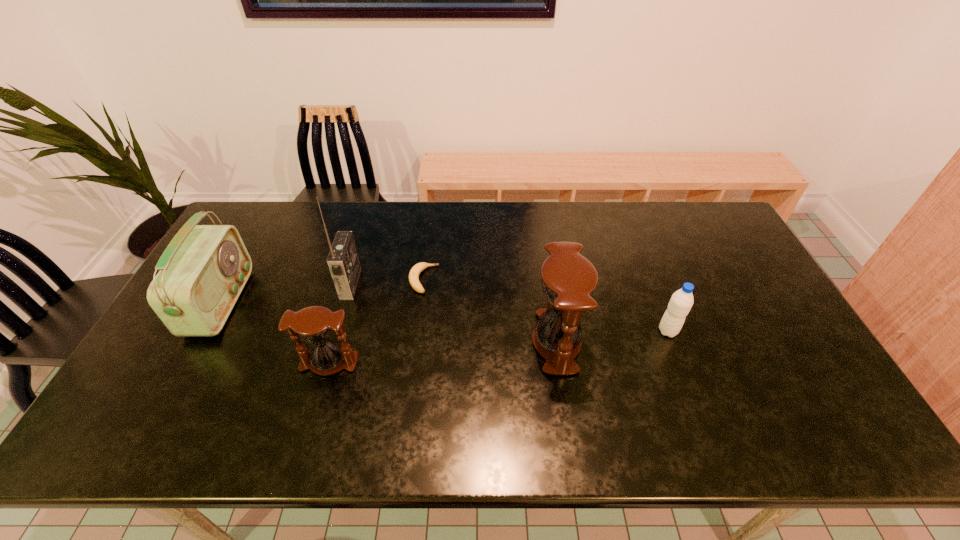
The width and height of the screenshot is (960, 540). What are the coordinates of `empty space between the water bottle and the taller hourglass` in the screenshot? It's located at (612, 336).

Where is `vacant space that's between the taller hourglass and the shortest object`? This screenshot has width=960, height=540. vacant space that's between the taller hourglass and the shortest object is located at coordinates (490, 310).

You are a GUI agent. You are given a task and a screenshot of the screen. Output one action in this format:
    pyautogui.click(x=<x>, y=<y>)
    Task: Click on the free spot between the fifth object from left to right and the shortest object
    This screenshot has height=540, width=960.
    Given the screenshot: What is the action you would take?
    pyautogui.click(x=490, y=310)

The height and width of the screenshot is (540, 960). Find the location of `free spot between the third object from right to left and the tallest object`. free spot between the third object from right to left and the tallest object is located at coordinates (387, 281).

This screenshot has width=960, height=540. In order to click on vacant space in between the taller hourglass and the left radio receiver in this screenshot , I will do `click(389, 322)`.

Where is `free space between the left radio receiver and the left hourglass`? This screenshot has width=960, height=540. free space between the left radio receiver and the left hourglass is located at coordinates pyautogui.click(x=275, y=333).

You are a GUI agent. You are given a task and a screenshot of the screen. Output one action in this format:
    pyautogui.click(x=<x>, y=<y>)
    Task: Click on the vacant space that's between the left radio receiver and the water bottle
    The image size is (960, 540).
    Given the screenshot: What is the action you would take?
    pyautogui.click(x=444, y=317)

Where is `vacant space that is in between the rightmost object and the left hourglass`? vacant space that is in between the rightmost object and the left hourglass is located at coordinates (498, 347).

Where is `vacant space that's between the fourth object from left to right and the right radio receiver`? This screenshot has width=960, height=540. vacant space that's between the fourth object from left to right and the right radio receiver is located at coordinates (387, 281).

Locate which object is the second closest to the taller hourglass. Please provide its 2D coordinates. Your answer should be formatted as a tuple, i.e. [(x, y)], where the tuple contains the x and y coordinates of a point satisfying the conditions above.

[(414, 273)]